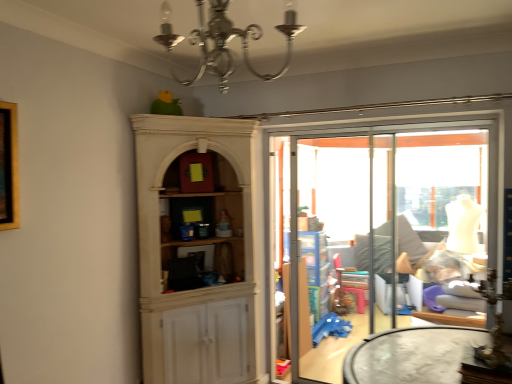
Question: Considering the positions of silver metallic chandelier at upper center and transparent glass screen door at center in the image, is silver metallic chandelier at upper center wider or thinner than transparent glass screen door at center?

Choices:
 (A) wide
 (B) thin

Answer: (A)

Question: Is silver metallic chandelier at upper center bigger or smaller than transparent glass screen door at center?

Choices:
 (A) big
 (B) small

Answer: (B)

Question: Estimate the real-world distances between objects in this image. Which object is farther from the silver metallic chandelier at upper center?

Choices:
 (A) transparent glass screen door at center
 (B) transparent glass window at center

Answer: (B)

Question: Which object is the closest to the transparent glass screen door at center?

Choices:
 (A) transparent glass window at center
 (B) silver metallic chandelier at upper center

Answer: (A)